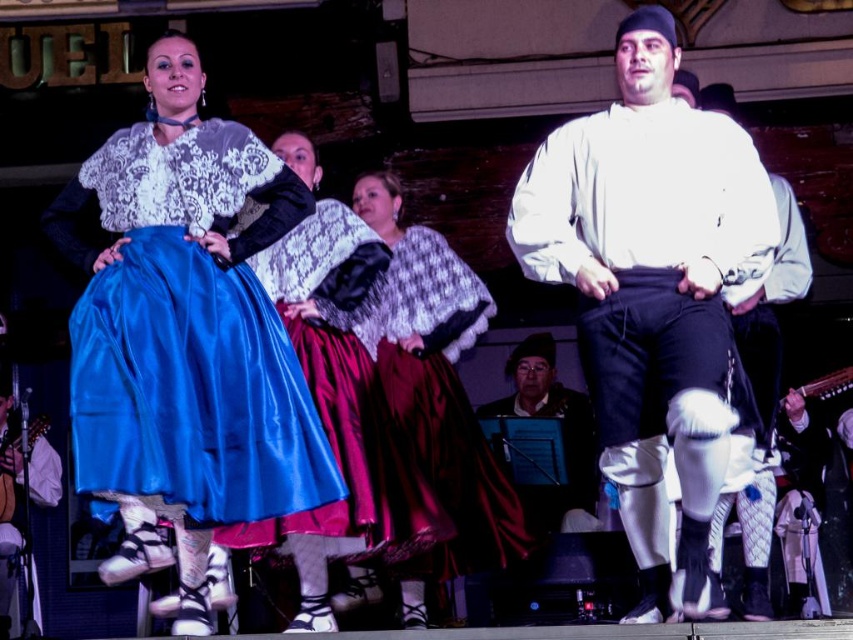
You are a photographer at the dance performance. You need to capture a photo where both the white matte shirt at center and the white cotton shirt at center are visible. Since the shirts have different widths, which one might require more space in the frame to ensure it is fully captured?

The white matte shirt at center has a greater width than the white cotton shirt at center, so it would require more space in the frame to ensure it is fully captured.

You are a photographer standing at the origin point of the coordinate system in the image. You want to take a photo of both point A at point [616,282] and point B at point [746,563]. Since you can only focus on one point at a time, which point should you focus on first to ensure both points are in the frame?

You should focus on point A at point [616,282] first because it is in front of point B at point [746,563]. By focusing on the closer point, both points will remain in the frame as the depth of field will include the background point as well.